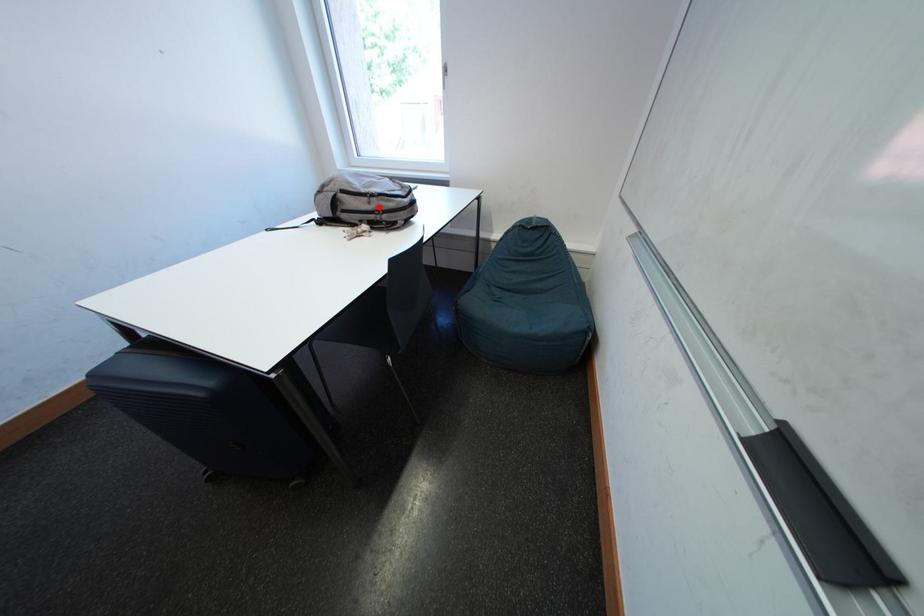
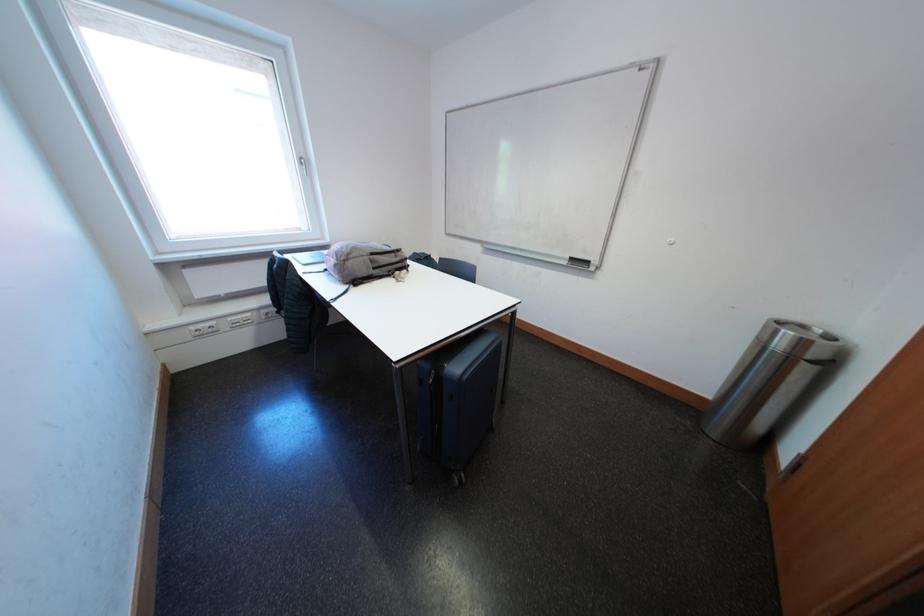
Where in the second image is the point corresponding to the highlighted location from the first image?

(406, 261)